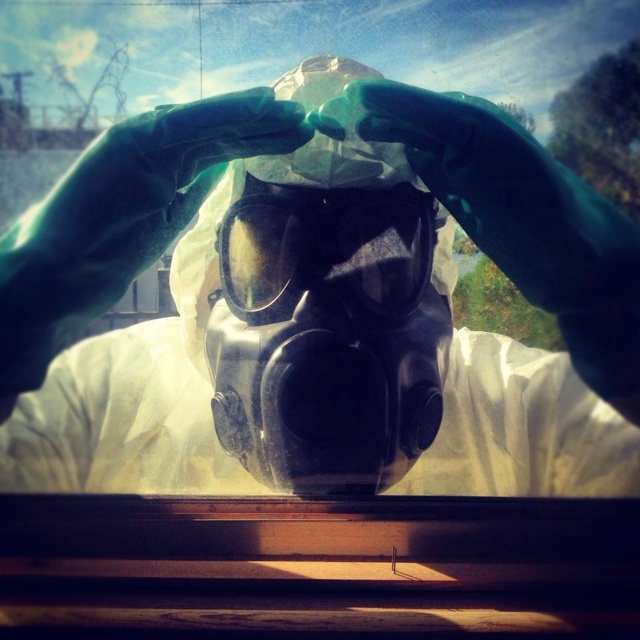
You are a safety inspector examining the protective gear through the window. You notice the black matte gas mask at center and the transparent plastic goggles at center. Which object is positioned closer to your viewpoint?

The black matte gas mask at center is closer to the viewer than the transparent plastic goggles at center.

You are a safety inspector reviewing the image of the protective gear setup. According to the standard safety protocol, the transparent plastic goggles at center must be positioned above the black matte gas mask at center to ensure proper eye protection. Is the current arrangement compliant with the safety standards?

The black matte gas mask at center is located below the transparent plastic goggles at center, which aligns with the requirement for the goggles to be above the gas mask. Therefore, the current arrangement is compliant with the safety standards.